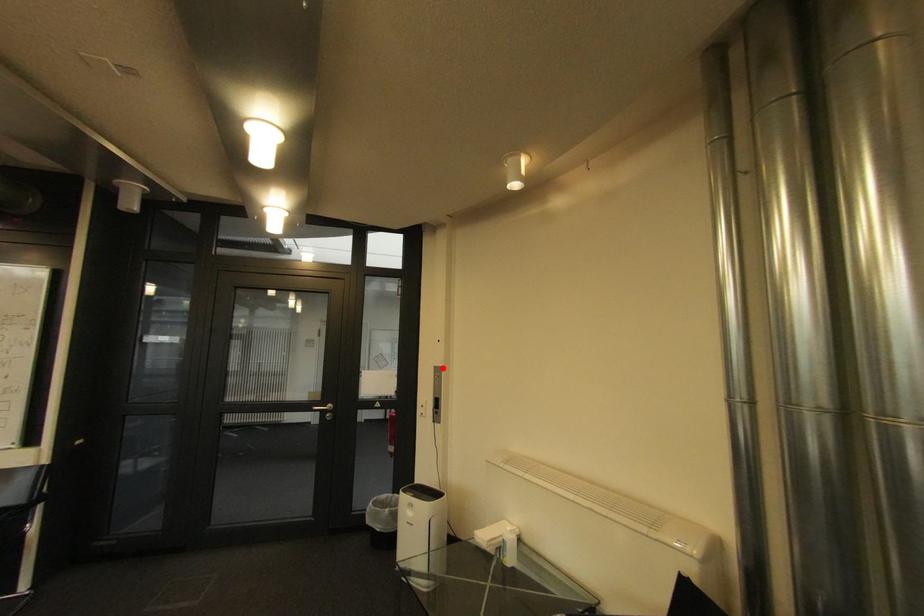
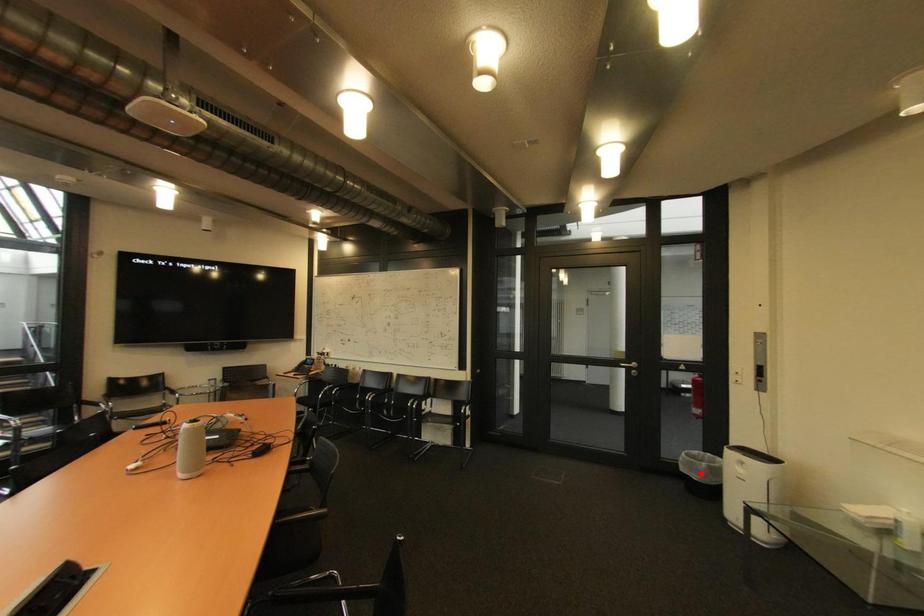
I am providing you with two images of the same scene from different viewpoints. A red point is marked on the first image and another point is marked on the second image. Do the highlighted points in image1 and image2 indicate the same real-world spot?

No